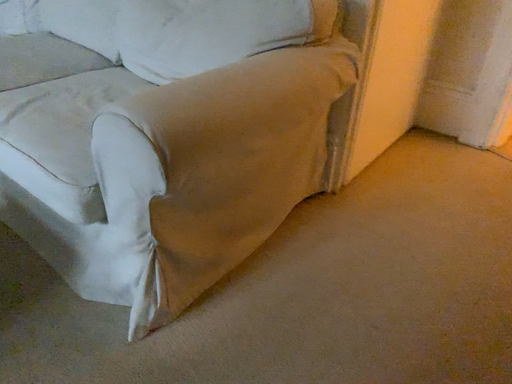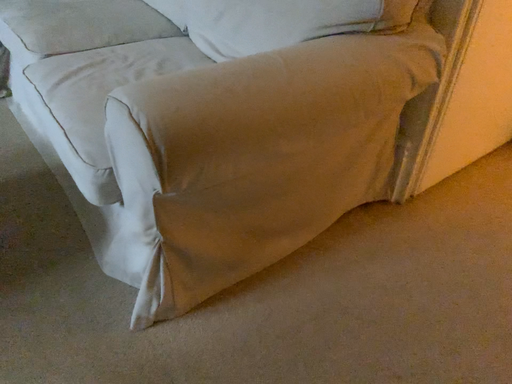
Question: Which way did the camera rotate in the video?

Choices:
 (A) rotated left
 (B) rotated right

Answer: (A)